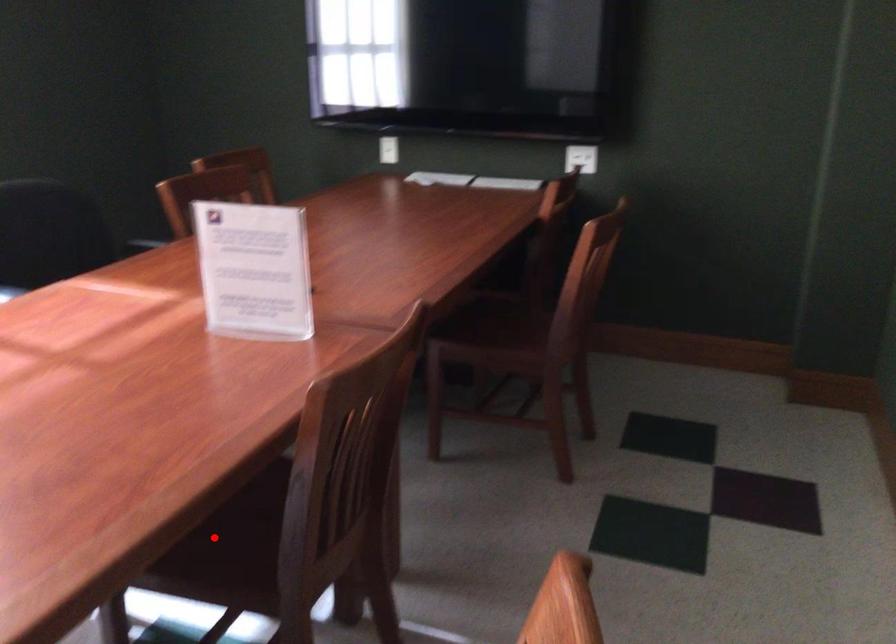
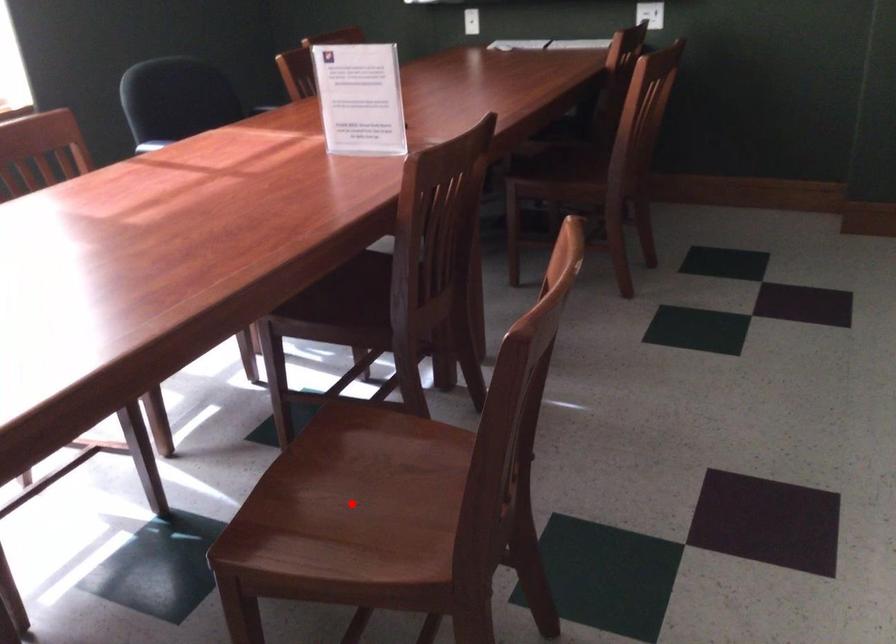
I am providing you with two images of the same scene from different viewpoints. A red point is marked on the first image and another point is marked on the second image. Is the red point in image1 aligned with the point shown in image2?

No